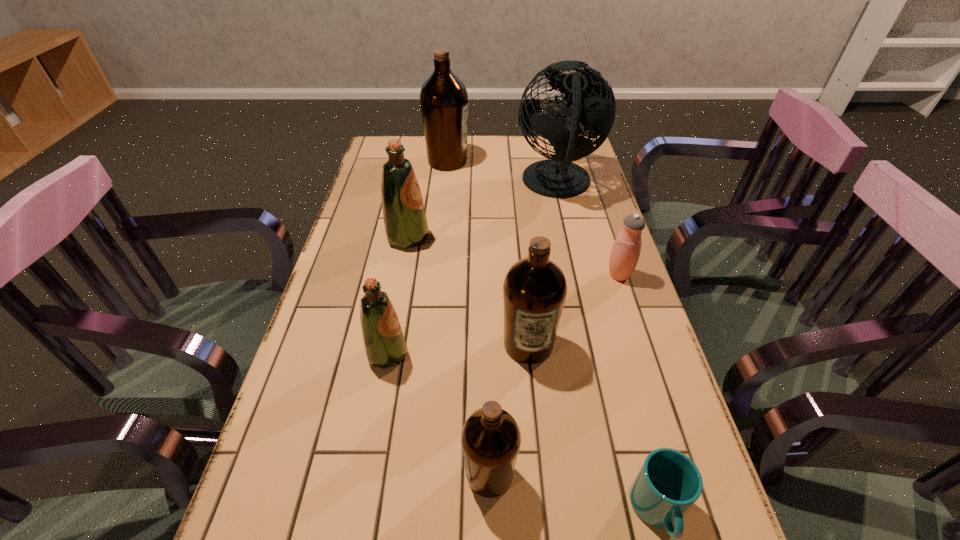
At what (x,y) coordinates should I click in order to perform the action: click on free spot that satisfies the following two spatial constraints: 1. on the front-facing side of the globe; 2. on the label of the second farthest brown olive oil. Please return your answer as a coordinate pair (x, y). This screenshot has height=540, width=960. Looking at the image, I should click on (594, 345).

Where is `free space that satisfies the following two spatial constraints: 1. on the label of the second biggest brown olive oil; 2. on the label of the nearest olive oil`? The height and width of the screenshot is (540, 960). free space that satisfies the following two spatial constraints: 1. on the label of the second biggest brown olive oil; 2. on the label of the nearest olive oil is located at coordinates (541, 474).